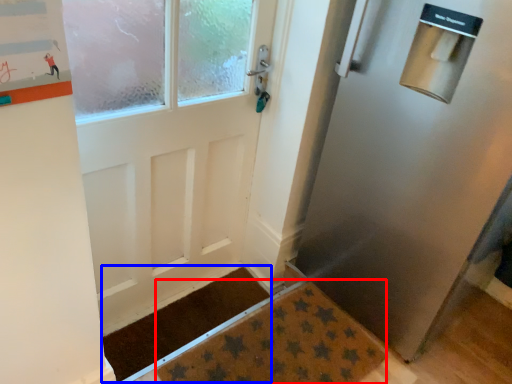
Question: Which point is closer to the camera, doormat (highlighted by a red box) or doormat (highlighted by a blue box)?

Choices:
 (A) doormat
 (B) doormat

Answer: (A)